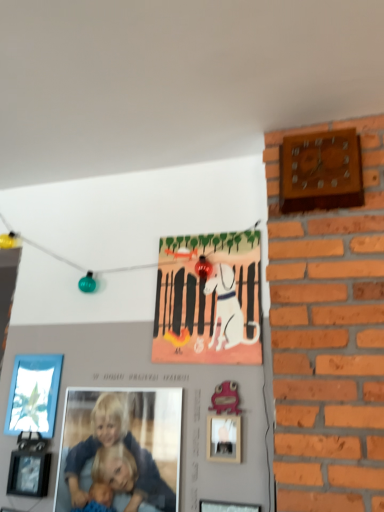
Question: Is wooden wall clock at upper right to the left or to the right of wooden picture frame at lower center, arranged as the second picture frame when viewed from the right, in the image?

Choices:
 (A) right
 (B) left

Answer: (A)

Question: Choose the correct answer: Is wooden wall clock at upper right inside wooden picture frame at lower center, which is counted as the third picture frame, starting from the left, or outside it?

Choices:
 (A) inside
 (B) outside

Answer: (B)

Question: Estimate the real-world distances between objects in this image. Which object is farther from the pink matte picture frame at center, the 1th picture frame from the right?

Choices:
 (A) black matte picture frame at lower left, which is the 2th picture frame from back to front
 (B) matte glass picture frame at lower left, which is the fourth picture frame in front-to-back order
 (C) matte paper postcard at center
 (D) matte blue shirt at center
 (E) wooden picture frame at lower center, the first picture frame from the front

Answer: (B)

Question: Which object is the closest to the matte blue shirt at center?

Choices:
 (A) wooden picture frame at lower center, the fourth picture frame viewed from the back
 (B) black matte picture frame at lower left, which is the 2th picture frame from back to front
 (C) pink matte picture frame at center, the fourth picture frame in the left-to-right sequence
 (D) matte paper postcard at center
 (E) wooden wall clock at upper right

Answer: (B)